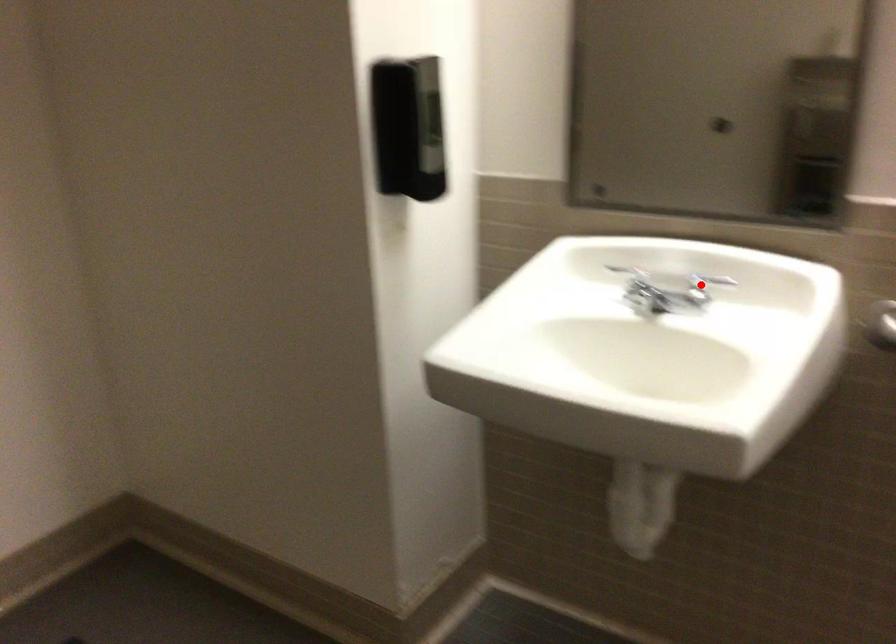
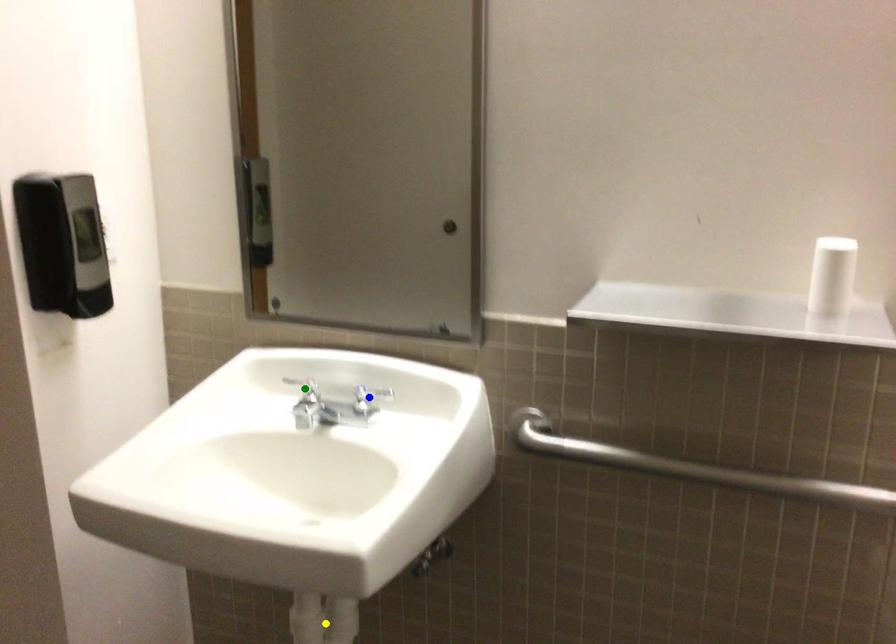
Question: I am providing you with two images of the same scene from different viewpoints. A red point is marked on the first image. You are given multiple points on the second image. Which point in image 2 is actually the same real-world point as the red point in image 1?

Choices:
 (A) blue point
 (B) green point
 (C) yellow point

Answer: (A)